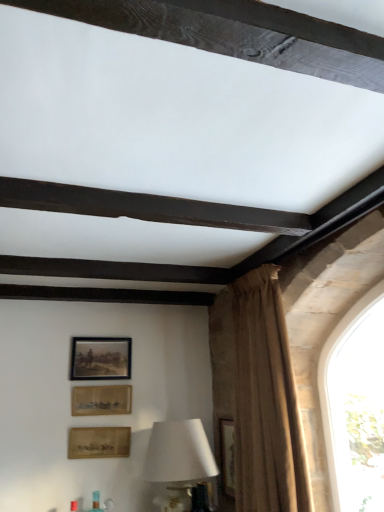
Question: Is point (94, 450) positioned closer to the camera than point (266, 322)?

Choices:
 (A) farther
 (B) closer

Answer: (A)

Question: From their relative heights in the image, would you say wooden framed picture at lower center, which is counted as the 1th picture frame, starting from the bottom, is taller or shorter than brown textured curtain at right?

Choices:
 (A) tall
 (B) short

Answer: (B)

Question: Estimate the real-world distances between objects in this image. Which object is closer to the wooden framed picture at lower center, which is counted as the 1th picture frame, starting from the bottom?

Choices:
 (A) wooden frame at upper center, which is counted as the 1th picture frame, starting from the top
 (B) brown textured curtain at right
 (C) wooden textured picture frame at lower center, the second picture frame in the top-to-bottom sequence
 (D) white matte table lamp at lower center

Answer: (C)

Question: Estimate the real-world distances between objects in this image. Which object is closer to the white matte table lamp at lower center?

Choices:
 (A) wooden frame at upper center, which is counted as the third picture frame, starting from the bottom
 (B) brown textured curtain at right
 (C) wooden textured picture frame at lower center, placed as the second picture frame when sorted from bottom to top
 (D) wooden framed picture at lower center, the third picture frame viewed from the top

Answer: (D)